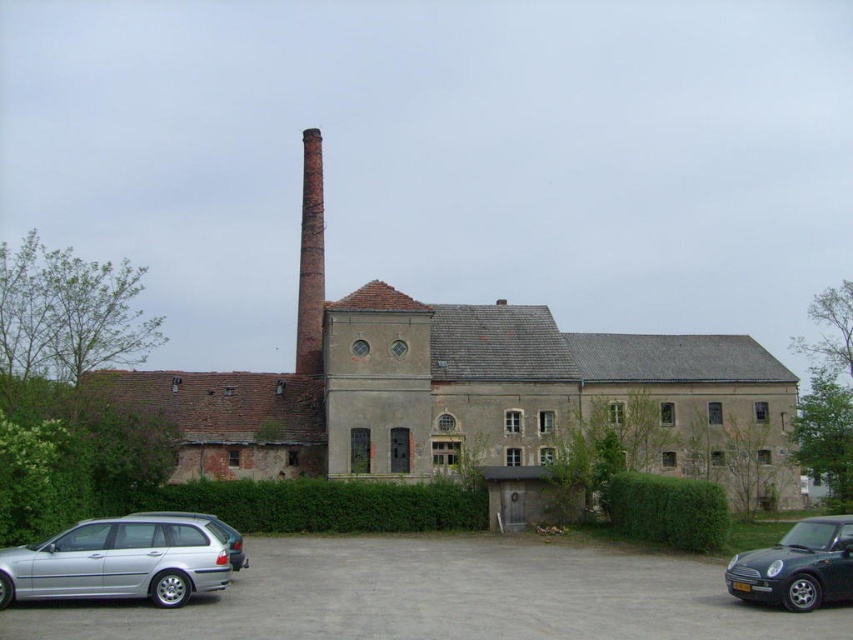
Question: Based on their relative distances, which object is nearer to the shiny black car at lower right?

Choices:
 (A) green leafy hedge at lower center
 (B) gray concrete building at center
 (C) green leafy hedge at center
 (D) silver metallic car at lower left

Answer: (A)

Question: Estimate the real-world distances between objects in this image. Which object is closer to the green leafy hedge at center?

Choices:
 (A) silver metallic car at lower left
 (B) silver metallic hatchback at lower left

Answer: (B)

Question: Can you confirm if red brick chimney at center is thinner than silver metallic hatchback at lower left?

Choices:
 (A) no
 (B) yes

Answer: (A)

Question: Among these points, which one is farthest from the camera?

Choices:
 (A) (173, 484)
 (B) (653, 515)
 (C) (309, 177)

Answer: (C)

Question: Is gray concrete parking lot at lower center positioned before shiny black car at lower right?

Choices:
 (A) yes
 (B) no

Answer: (A)

Question: Is gray concrete parking lot at lower center thinner than silver metallic hatchback at lower left?

Choices:
 (A) yes
 (B) no

Answer: (B)